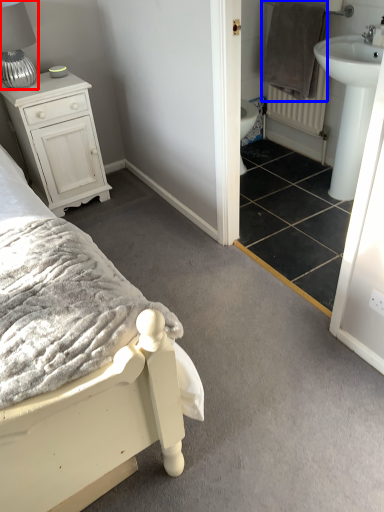
Question: Which object is further to the camera taking this photo, table lamp (highlighted by a red box) or blanket (highlighted by a blue box)?

Choices:
 (A) table lamp
 (B) blanket

Answer: (B)